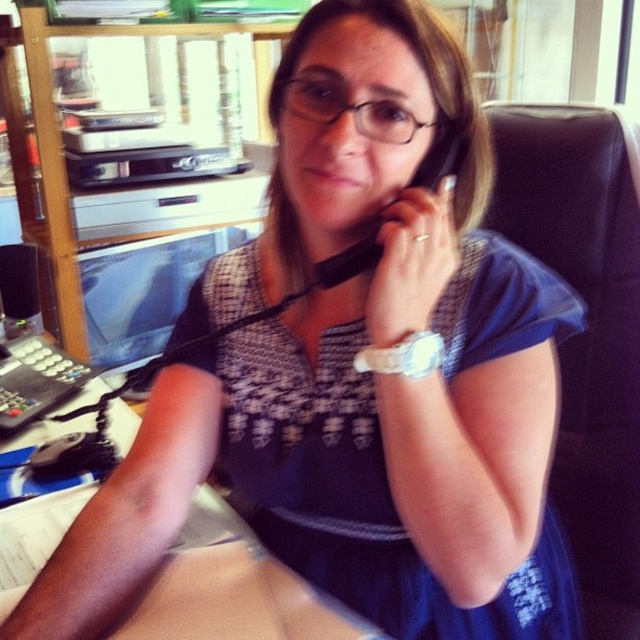
Does blue woven dress at center lie behind black leather chair at right?

No.

Is point (189, 333) farther from viewer compared to point (608, 188)?

No, (189, 333) is in front of (608, 188).

The height and width of the screenshot is (640, 640). In order to click on blue woven dress at center in this screenshot , I will do `click(355, 492)`.

Is blue woven dress at center further to the viewer compared to wooden table at lower center?

Yes, it is behind wooden table at lower center.

Does blue woven dress at center appear over wooden table at lower center?

Yes.

Who is more forward, (508, 266) or (248, 627)?

Point (248, 627)

Identify the location of blue woven dress at center. This screenshot has width=640, height=640. (355, 492).

Does black leather chair at right have a lesser height compared to black rubberized phone at center?

Incorrect, black leather chair at right's height does not fall short of black rubberized phone at center's.

Who is positioned more to the left, black leather chair at right or black rubberized phone at center?

black rubberized phone at center is more to the left.

Is point (624, 474) farther from camera compared to point (321, 266)?

Yes, it is behind point (321, 266).

The width and height of the screenshot is (640, 640). What are the coordinates of `black leather chair at right` in the screenshot? It's located at (586, 326).